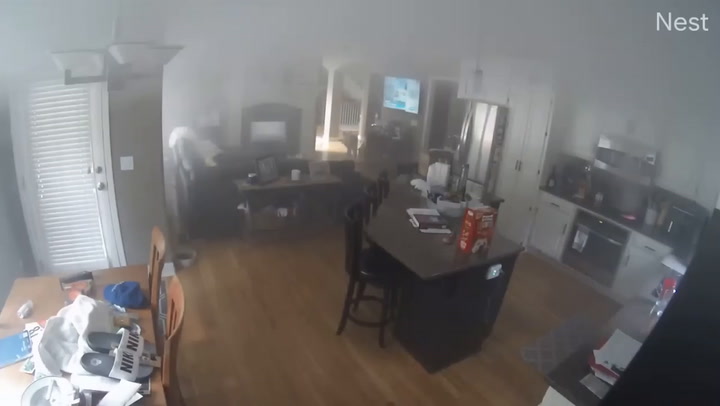
You are a GUI agent. You are given a task and a screenshot of the screen. Output one action in this format:
    pyautogui.click(x=<x>, y=<y>)
    Task: Click on the floor
    
    Given the screenshot: What is the action you would take?
    pyautogui.click(x=292, y=333)